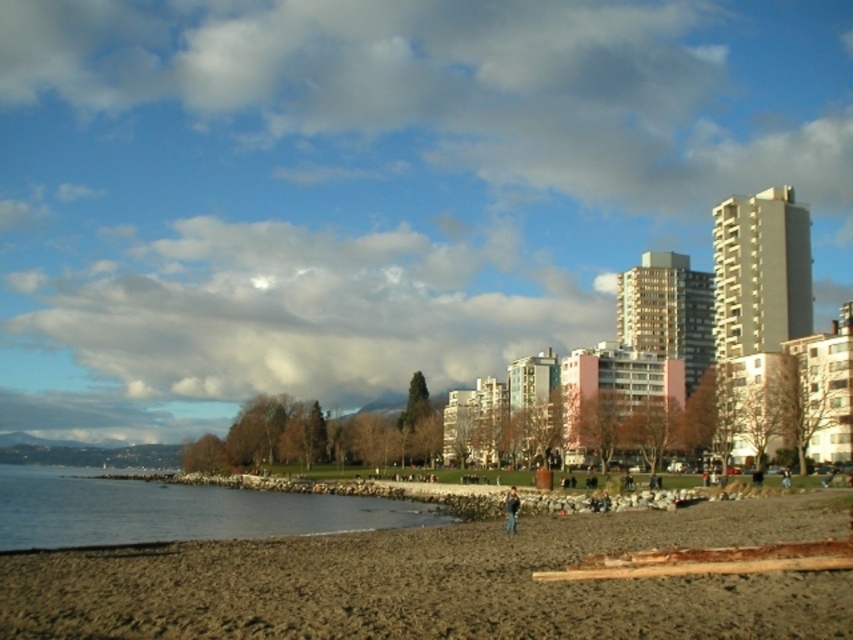
You are standing on the brown sandy beach at lower left and want to reach the dark brown leather jacket at lower center. Which direction should you move to get closer to the jacket?

You should move towards the direction of the dark brown leather jacket at lower center since the brown sandy beach at lower left is in front of it, meaning the jacket is behind the beach area from your current position.

You are standing on the beach and want to reach the clear water at lower left without getting your dark brown leather jacket at lower center wet. Which direction should you walk to stay away from the water?

The clear water at lower left is below the dark brown leather jacket at lower center, so to avoid getting your jacket wet, you should walk away from the water in the direction opposite to the lower left, perhaps towards the midground trees or the residential buildings.